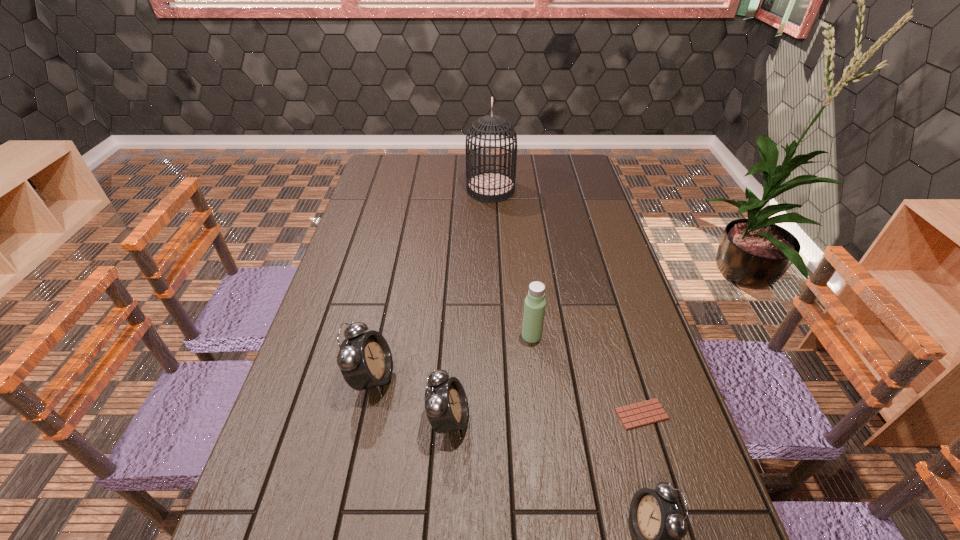
Identify which alarm clock is the closest to the leftmost object. Please provide its 2D coordinates. Your answer should be formatted as a tuple, i.e. [(x, y)], where the tuple contains the x and y coordinates of a point satisfying the conditions above.

[(446, 405)]

Find the location of a particular element. The image size is (960, 540). free space that satisfies the following two spatial constraints: 1. on the back side of the shortest object; 2. on the face of the leftmost alarm clock is located at coordinates (631, 379).

You are a GUI agent. You are given a task and a screenshot of the screen. Output one action in this format:
    pyautogui.click(x=<x>, y=<y>)
    Task: Click on the vacant position in the image that satisfies the following two spatial constraints: 1. on the front side of the shortest object; 2. on the right side of the second farthest object
    
    Given the screenshot: What is the action you would take?
    pyautogui.click(x=540, y=414)